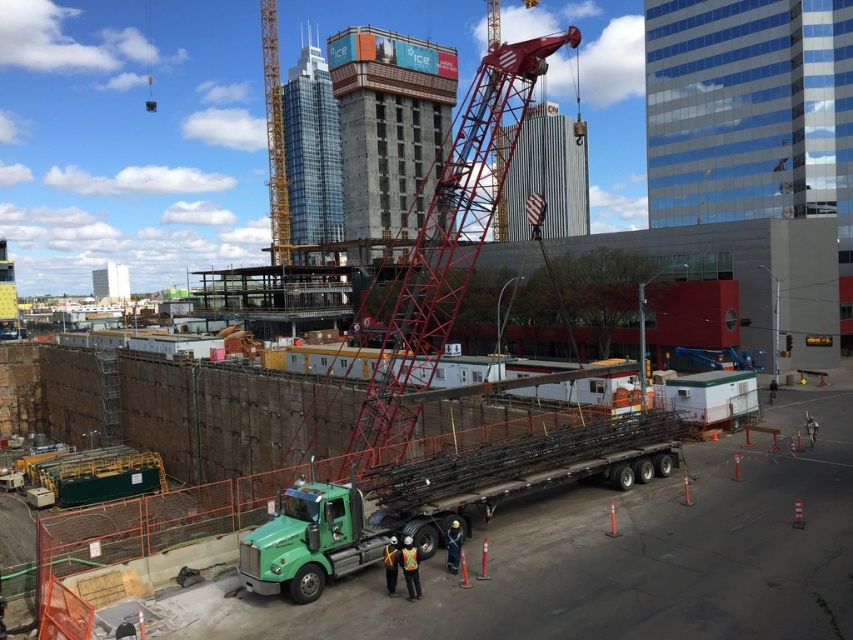
Question: Which point is closer to the camera?

Choices:
 (A) (392, 547)
 (B) (404, 554)

Answer: (B)

Question: Does red metal crane at center appear on the right side of dark blue reflective safety vest at lower center?

Choices:
 (A) yes
 (B) no

Answer: (A)

Question: Which point is farther from the camera taking this photo?

Choices:
 (A) (325, 531)
 (B) (450, 556)
 (C) (398, 557)

Answer: (B)

Question: Does dark blue reflective safety vest at lower center have a smaller size compared to reflective orange vest at lower center?

Choices:
 (A) yes
 (B) no

Answer: (A)

Question: Estimate the real-world distances between objects in this image. Which object is closer to the red metal crane at center?

Choices:
 (A) green concrete truck at center
 (B) green metallic trailer truck at center
 (C) reflective orange vest at lower center

Answer: (A)

Question: Is red metal crane at center positioned before dark blue reflective safety vest at lower center?

Choices:
 (A) yes
 (B) no

Answer: (B)